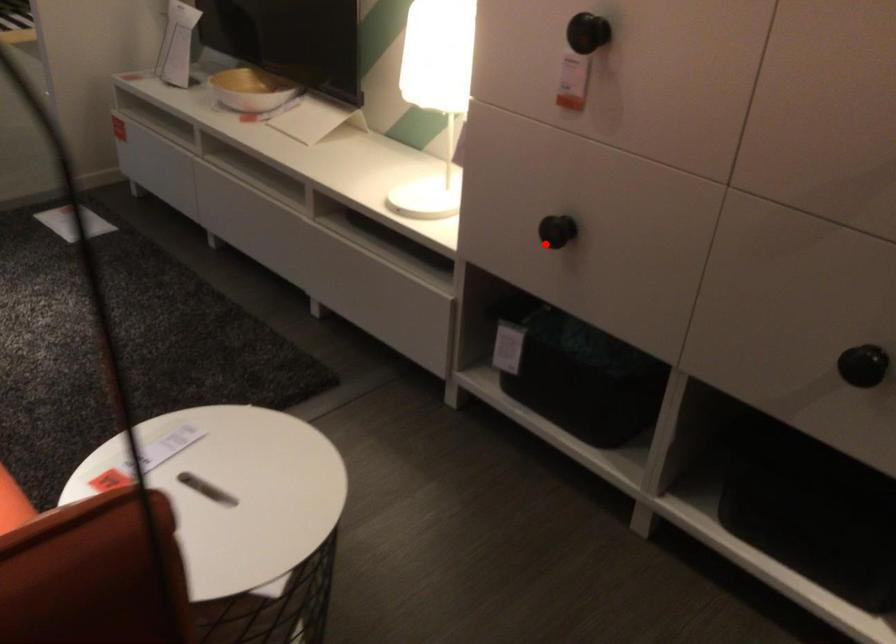
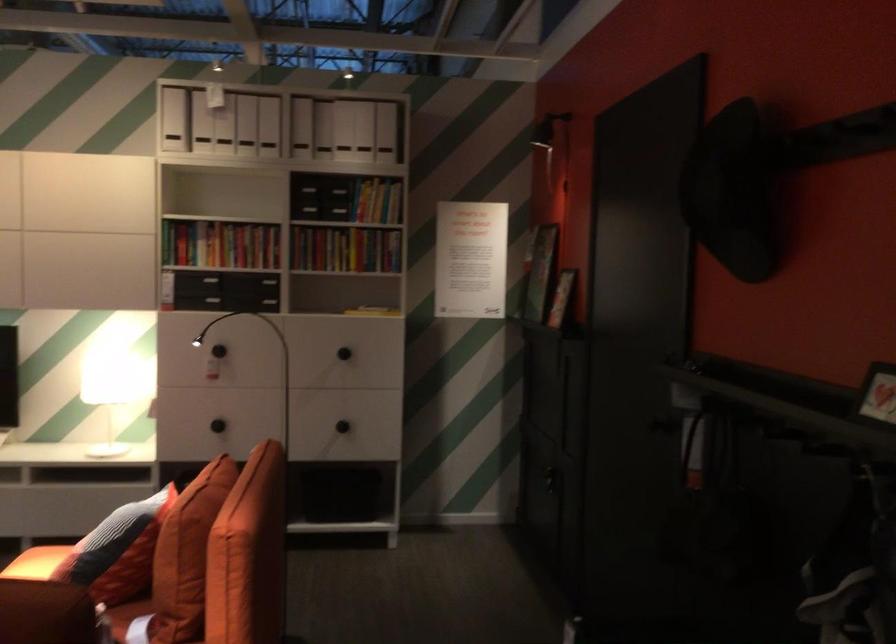
Question: I am providing you with two images of the same scene from different viewpoints. Image1 has a red point marked. In image2, the corresponding 3D location appears at what relative position? Reply with the corresponding letter.

Choices:
 (A) Closer
 (B) Farther

Answer: (B)